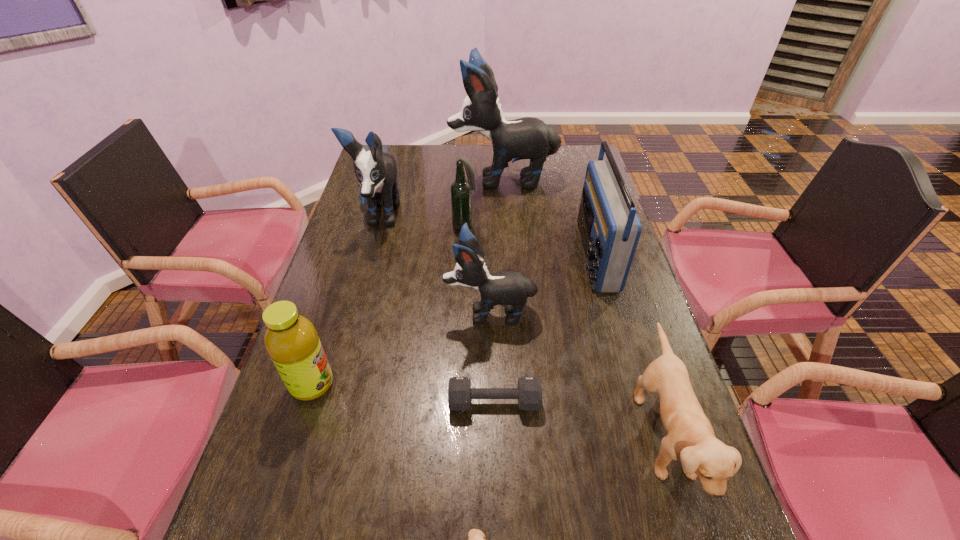
I want to click on blank region between the blue radio receiver and the fruit juice, so click(x=453, y=320).

Where is `empty location between the fourth shortest puppy and the fourth tallest puppy`? The height and width of the screenshot is (540, 960). empty location between the fourth shortest puppy and the fourth tallest puppy is located at coordinates (521, 326).

You are a GUI agent. You are given a task and a screenshot of the screen. Output one action in this format:
    pyautogui.click(x=<x>, y=<y>)
    Task: Click on the vacant region between the dark beer bottle and the radio receiver
    This screenshot has width=960, height=540.
    Given the screenshot: What is the action you would take?
    pyautogui.click(x=530, y=240)

Locate an element on the screen. This screenshot has width=960, height=540. free space between the dumbbell and the rightmost puppy is located at coordinates (579, 418).

Where is `object that is the eighth closest one to the fruit juice`? Image resolution: width=960 pixels, height=540 pixels. object that is the eighth closest one to the fruit juice is located at coordinates (530, 138).

Identify which object is the sixth closest to the nearest puppy. Please provide its 2D coordinates. Your answer should be formatted as a tuple, i.e. [(x, y)], where the tuple contains the x and y coordinates of a point satisfying the conditions above.

[(376, 171)]

Locate which puppy is the third closest to the dark beer bottle. Please provide its 2D coordinates. Your answer should be formatted as a tuple, i.e. [(x, y)], where the tuple contains the x and y coordinates of a point satisfying the conditions above.

[(510, 288)]

Image resolution: width=960 pixels, height=540 pixels. Identify the location of the closest puppy to the smaller beige puppy. (691, 439).

Choose which black puppy is the second nearest neighbor to the smallest black puppy. Please provide its 2D coordinates. Your answer should be formatted as a tuple, i.e. [(x, y)], where the tuple contains the x and y coordinates of a point satisfying the conditions above.

[(530, 138)]

In order to click on the closest black puppy to the nearest object in this screenshot , I will do `click(510, 288)`.